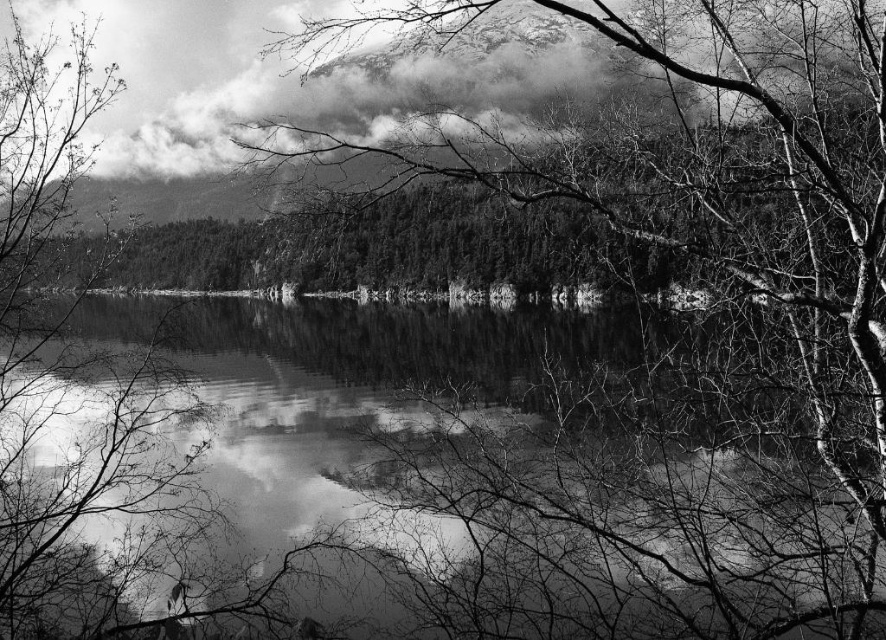
Question: Considering the real-world distances, which object is farthest from the smooth water at center?

Choices:
 (A) cloudy white cloud at upper center
 (B) smooth bark tree at center

Answer: (A)

Question: Can you confirm if smooth bark tree at center is positioned to the right of cloudy white cloud at upper center?

Choices:
 (A) no
 (B) yes

Answer: (B)

Question: Does smooth bark tree at center lie behind cloudy white cloud at upper center?

Choices:
 (A) yes
 (B) no

Answer: (B)

Question: Which object appears farthest from the camera in this image?

Choices:
 (A) smooth water at center
 (B) cloudy white cloud at upper center

Answer: (B)

Question: Which object appears farthest from the camera in this image?

Choices:
 (A) cloudy white cloud at upper center
 (B) smooth water at center

Answer: (A)

Question: Considering the relative positions of smooth water at center and smooth bark tree at center in the image provided, where is smooth water at center located with respect to smooth bark tree at center?

Choices:
 (A) below
 (B) above

Answer: (A)